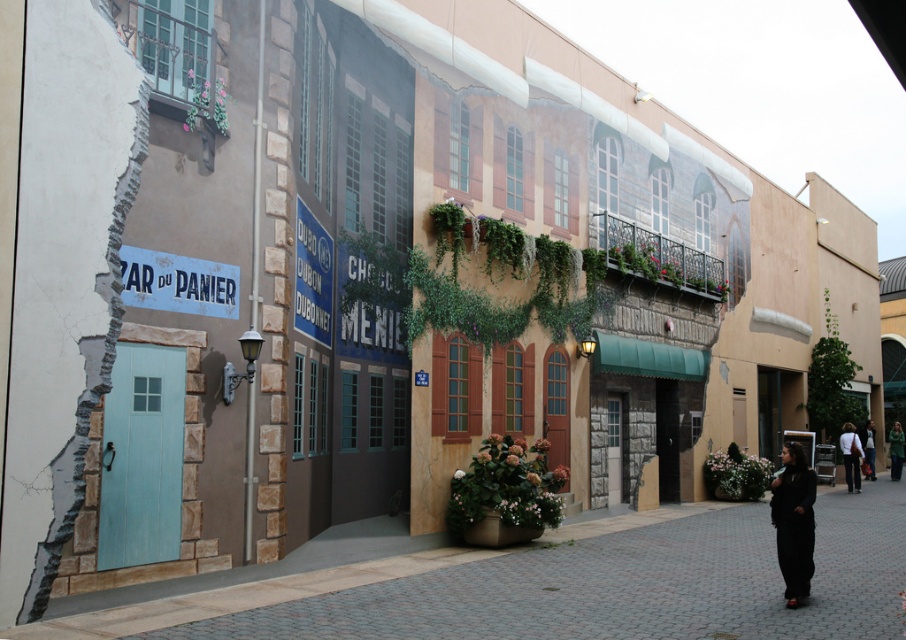
Question: Which object appears closest to the camera in this image?

Choices:
 (A) green sweater at lower right
 (B) dark gray fabric jacket at lower right

Answer: (B)

Question: Is dark blue jeans at lower right bigger than green sweater at lower right?

Choices:
 (A) no
 (B) yes

Answer: (B)

Question: In this image, where is dark blue jeans at lower right located relative to green sweater at lower right?

Choices:
 (A) below
 (B) above

Answer: (B)

Question: Which point appears farthest from the camera in this image?

Choices:
 (A) (864, 474)
 (B) (710, 589)
 (C) (858, 448)
 (D) (776, 502)

Answer: (A)

Question: From the image, what is the correct spatial relationship of dark blue jeans at lower right in relation to green sweater at lower right?

Choices:
 (A) right
 (B) left

Answer: (B)

Question: Which of the following is the farthest from the observer?

Choices:
 (A) black matte dress at lower right
 (B) dark blue jeans at lower right

Answer: (B)